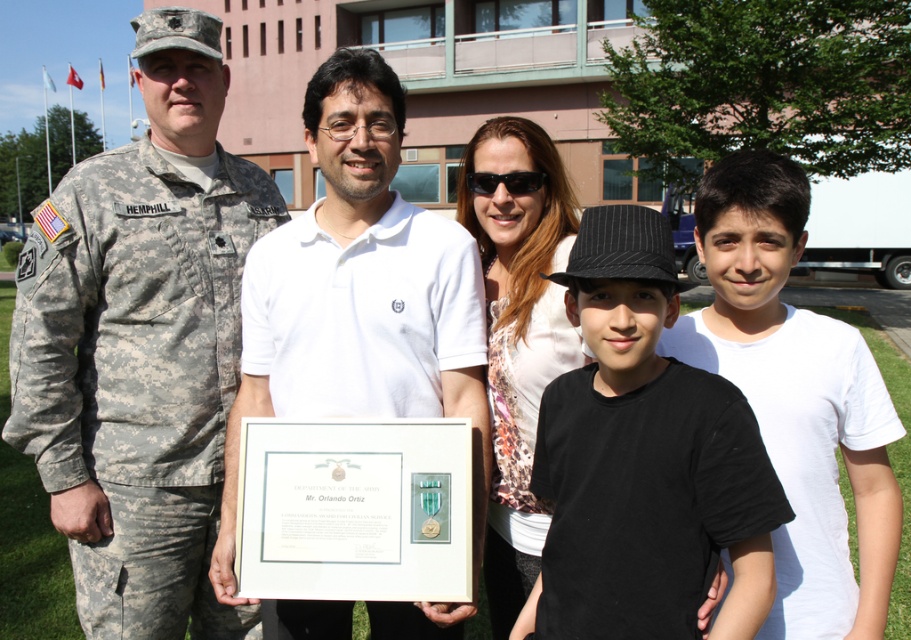
You are a photographer who needs to adjust the lighting to ensure both the white matte shirt at center and the white printed shirt at center are visible. Which shirt requires more light adjustment due to its size?

The white matte shirt at center has a larger size compared to the white printed shirt at center, so it requires more light adjustment to ensure visibility.

You are a photographer trying to arrange the subjects for a group photo. You notice the white matte shirt at center and the white cotton shirt at right. Which one should you ask to stand on a stool to ensure both are at eye level?

The white cotton shirt at right should stand on a stool because the white matte shirt at center is taller than the white cotton shirt at right.